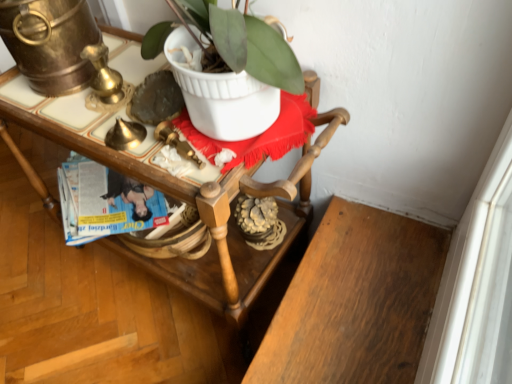
Image resolution: width=512 pixels, height=384 pixels. I want to click on wooden desk at center, so click(108, 279).

This screenshot has width=512, height=384. What do you see at coordinates (108, 279) in the screenshot?
I see `wooden desk at center` at bounding box center [108, 279].

This screenshot has width=512, height=384. What do you see at coordinates (105, 202) in the screenshot?
I see `blue glossy magazine at center` at bounding box center [105, 202].

What is the approximate width of blue glossy magazine at center?

The width of blue glossy magazine at center is 12.61 inches.

Based on the photo, what is the approximate height of blue glossy magazine at center?

2.66 inches.

The height and width of the screenshot is (384, 512). Find the location of `blue glossy magazine at center`. blue glossy magazine at center is located at coordinates (105, 202).

In order to click on wooden desk at center in this screenshot , I will do `click(108, 279)`.

Can you confirm if blue glossy magazine at center is positioned to the right of wooden desk at center?

No, blue glossy magazine at center is not to the right of wooden desk at center.

Which is in front, blue glossy magazine at center or wooden desk at center?

wooden desk at center is more forward.

Is point (98, 200) closer to viewer compared to point (1, 232)?

That is True.

From the image's perspective, which one is positioned higher, blue glossy magazine at center or wooden desk at center?

blue glossy magazine at center appears higher in the image.

From a real-world perspective, is blue glossy magazine at center on wooden desk at center?

No.

Between blue glossy magazine at center and wooden desk at center, which one has smaller width?

blue glossy magazine at center is thinner.

Considering the sizes of blue glossy magazine at center and wooden desk at center in the image, is blue glossy magazine at center taller or shorter than wooden desk at center?

Clearly, blue glossy magazine at center is shorter compared to wooden desk at center.

Considering the relative sizes of blue glossy magazine at center and wooden desk at center in the image provided, is blue glossy magazine at center bigger than wooden desk at center?

Actually, blue glossy magazine at center might be smaller than wooden desk at center.

Is wooden desk at center located within blue glossy magazine at center?

Definitely not — wooden desk at center is not inside blue glossy magazine at center.

Does blue glossy magazine at center touch wooden desk at center?

blue glossy magazine at center is not next to wooden desk at center, and they're not touching.

Is blue glossy magazine at center facing away from wooden desk at center?

Yes, wooden desk at center is at the back of blue glossy magazine at center.

At what (x,y) coordinates should I click in order to perform the action: click on magazine above the wooden desk at center (from the image's perspective). Please return your answer as a coordinate pair (x, y). The width and height of the screenshot is (512, 384). Looking at the image, I should click on (105, 202).

Does wooden desk at center appear on the left side of blue glossy magazine at center?

Incorrect, wooden desk at center is not on the left side of blue glossy magazine at center.

Is wooden desk at center further to camera compared to blue glossy magazine at center?

No.

Is point (50, 229) closer or farther from the camera than point (164, 205)?

Clearly, point (50, 229) is more distant from the camera than point (164, 205).

From the image's perspective, is wooden desk at center under blue glossy magazine at center?

Yes.

From a real-world perspective, is wooden desk at center physically below blue glossy magazine at center?

No, from a real-world perspective, wooden desk at center is not under blue glossy magazine at center.

Between wooden desk at center and blue glossy magazine at center, which one has larger width?

Wider between the two is wooden desk at center.

Considering the sizes of wooden desk at center and blue glossy magazine at center in the image, is wooden desk at center taller or shorter than blue glossy magazine at center?

Considering their sizes, wooden desk at center has more height than blue glossy magazine at center.

In the scene shown: Considering the relative sizes of wooden desk at center and blue glossy magazine at center in the image provided, is wooden desk at center smaller than blue glossy magazine at center?

→ No, wooden desk at center is not smaller than blue glossy magazine at center.

Consider the image. Is blue glossy magazine at center located within wooden desk at center?

Yes, blue glossy magazine at center can be found within wooden desk at center.

In the scene shown: Is wooden desk at center next to blue glossy magazine at center?

No, wooden desk at center is not touching blue glossy magazine at center.

Could you tell me if wooden desk at center is facing blue glossy magazine at center?

Yes.

How different are the orientations of wooden desk at center and blue glossy magazine at center in degrees?

The angular difference between wooden desk at center and blue glossy magazine at center is 35.5 degrees.

Measure the distance between wooden desk at center and blue glossy magazine at center.

They are 22.86 centimeters apart.

Locate an element on the screen. The image size is (512, 384). desk on the right of blue glossy magazine at center is located at coordinates (108, 279).

Locate an element on the screen. magazine on the left of wooden desk at center is located at coordinates (105, 202).

You are a GUI agent. You are given a task and a screenshot of the screen. Output one action in this format:
    pyautogui.click(x=<x>, y=<y>)
    Task: Click on the magazine above the wooden desk at center (from the image's perspective)
    Image resolution: width=512 pixels, height=384 pixels.
    Given the screenshot: What is the action you would take?
    pyautogui.click(x=105, y=202)